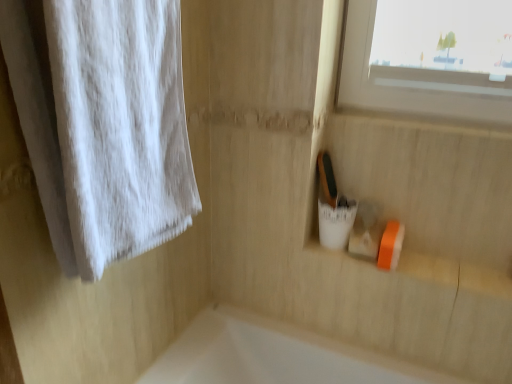
Question: From the image's perspective, is white cotton towel at left located above or below orange rubber at lower right?

Choices:
 (A) above
 (B) below

Answer: (A)

Question: Based on their sizes in the image, would you say white cotton towel at left is bigger or smaller than orange rubber at lower right?

Choices:
 (A) big
 (B) small

Answer: (A)

Question: Is white cotton towel at left to the left or to the right of orange rubber at lower right in the image?

Choices:
 (A) right
 (B) left

Answer: (B)

Question: Is orange rubber at lower right bigger or smaller than white cotton towel at left?

Choices:
 (A) big
 (B) small

Answer: (B)

Question: Is point (308, 244) closer or farther from the camera than point (55, 104)?

Choices:
 (A) closer
 (B) farther

Answer: (B)

Question: Would you say orange rubber at lower right is to the left or to the right of white cotton towel at left in the picture?

Choices:
 (A) left
 (B) right

Answer: (B)

Question: From a real-world perspective, is orange rubber at lower right above or below white cotton towel at left?

Choices:
 (A) above
 (B) below

Answer: (B)